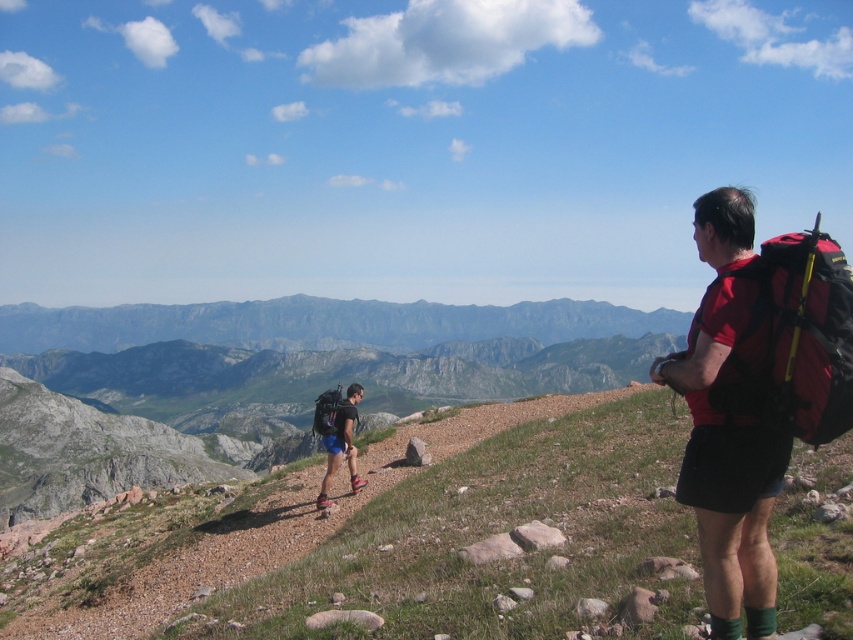
Between green grassy hillside at center and matte blue shorts at center, which one appears on the right side from the viewer's perspective?

green grassy hillside at center is more to the right.

Measure the distance between green grassy hillside at center and camera.

The distance of green grassy hillside at center from camera is 14.56 meters.

The height and width of the screenshot is (640, 853). Find the location of `green grassy hillside at center`. green grassy hillside at center is located at coordinates (392, 540).

Which of these two, green grassy hillside at center or red fabric backpack at right, stands taller?

green grassy hillside at center

What do you see at coordinates (392, 540) in the screenshot? I see `green grassy hillside at center` at bounding box center [392, 540].

This screenshot has width=853, height=640. In order to click on green grassy hillside at center in this screenshot , I will do `click(392, 540)`.

Who is higher up, matte blue shorts at center or matte black backpack at center?

matte black backpack at center is higher up.

Which of these two, matte blue shorts at center or matte black backpack at center, stands shorter?

matte black backpack at center is shorter.

Identify the location of matte blue shorts at center. Image resolution: width=853 pixels, height=640 pixels. (341, 444).